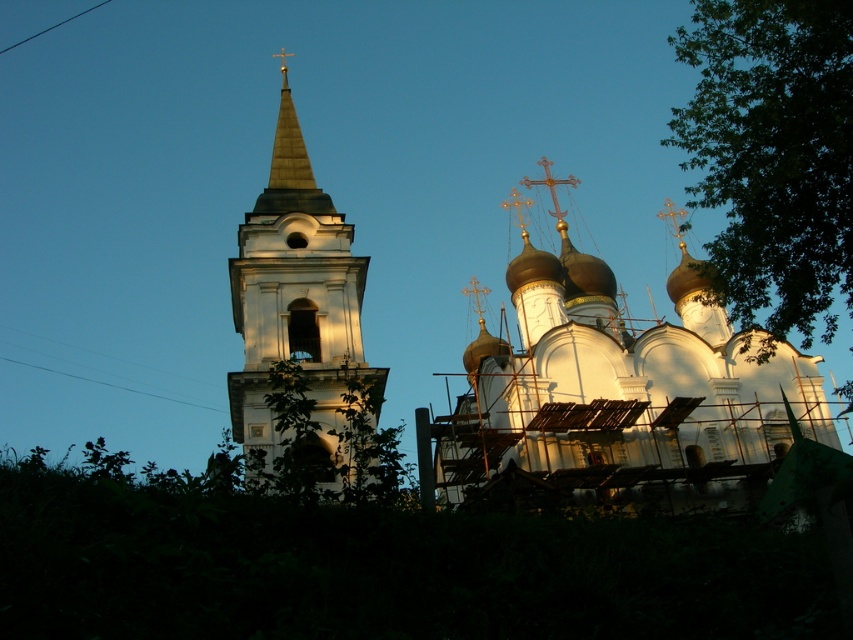
You are standing in front of the church and want to take a photo of both the white textured dome at center and the green leafy tree at upper right. Which one should you focus on first to ensure both are in the frame?

You should focus on the white textured dome at center first because it is closer to you than the green leafy tree at upper right, so adjusting the camera to include it will also capture the tree in the background.

You are a construction worker assessing the church structure. You see the white textured dome at center and the white stone bell tower at center. Which object is located higher up in the image?

The white stone bell tower at center is higher up because the white textured dome at center is positioned under it.

Consider the image. You are a construction worker needing to transport materials between the white textured dome at center and the white stone bell tower at center. Given that your equipment can carry materials up to 20 meters, will you need to make multiple trips due to the distance?

The distance between the white textured dome at center and the white stone bell tower at center is 21.26 meters. Since your equipment can only carry materials up to 20 meters, you will need to make multiple trips to cover the entire distance.